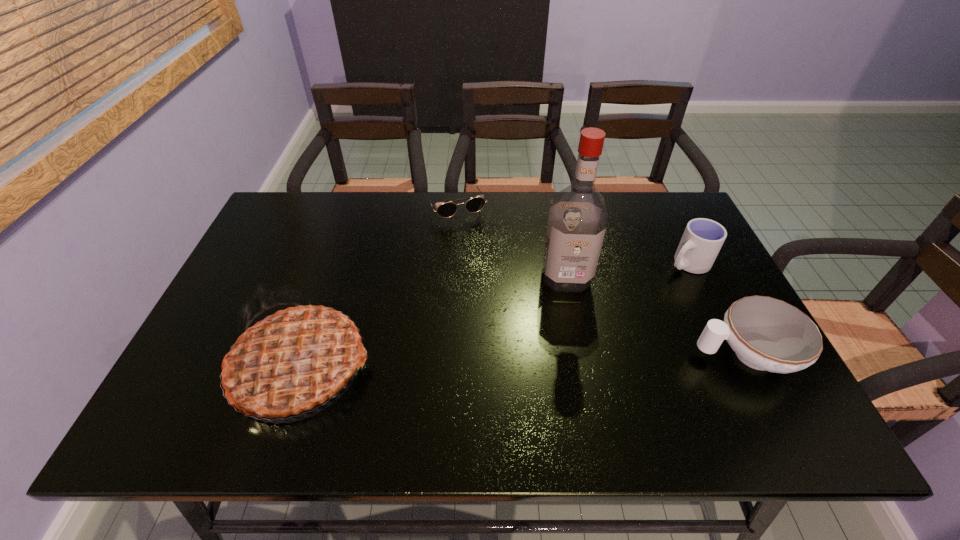
I want to click on free spot that satisfies the following two spatial constraints: 1. on the front side of the sunglasses; 2. on the side with the handle of the chinaware, so click(x=446, y=354).